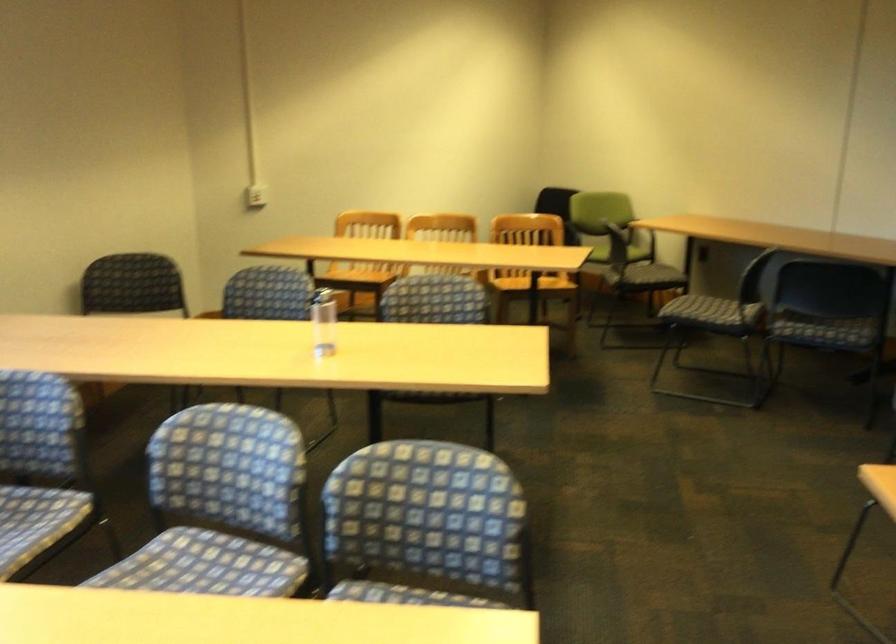
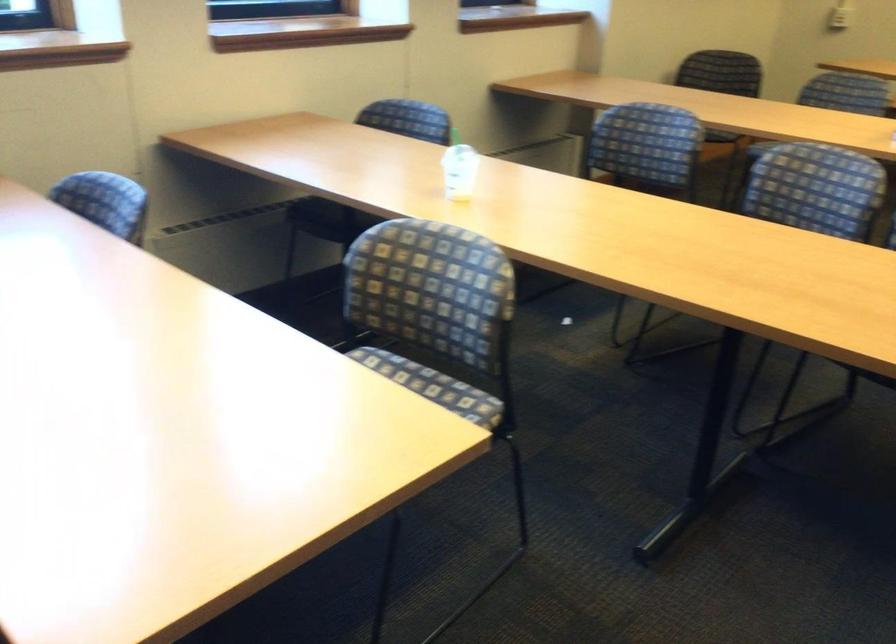
Question: The camera is either moving clockwise (left) or counter-clockwise (right) around the object. The first image is from the beginning of the video and the second image is from the end. Is the camera moving left or right when shooting the video?

Choices:
 (A) Left
 (B) Right

Answer: (B)